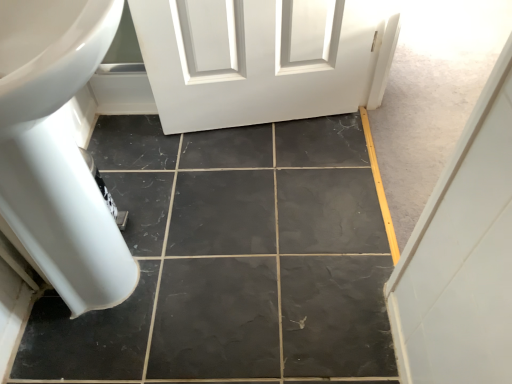
Question: From the image's perspective, does black marble tile at center appear higher than white glossy bath at left?

Choices:
 (A) no
 (B) yes

Answer: (A)

Question: Is black marble tile at center to the left of white glossy bath at left from the viewer's perspective?

Choices:
 (A) yes
 (B) no

Answer: (B)

Question: Is black marble tile at center facing towards white glossy bath at left?

Choices:
 (A) no
 (B) yes

Answer: (A)

Question: Does black marble tile at center lie behind white glossy bath at left?

Choices:
 (A) no
 (B) yes

Answer: (B)

Question: Would you say black marble tile at center is a long distance from white glossy bath at left?

Choices:
 (A) yes
 (B) no

Answer: (B)

Question: From the image's perspective, is black marble tile at center beneath white glossy bath at left?

Choices:
 (A) no
 (B) yes

Answer: (B)

Question: From a real-world perspective, is white glossy bath at left under black marble tile at center?

Choices:
 (A) yes
 (B) no

Answer: (B)

Question: Is white glossy bath at left taller than black marble tile at center?

Choices:
 (A) yes
 (B) no

Answer: (A)

Question: Can you confirm if white glossy bath at left is smaller than black marble tile at center?

Choices:
 (A) yes
 (B) no

Answer: (B)

Question: Is white glossy bath at left aimed at black marble tile at center?

Choices:
 (A) no
 (B) yes

Answer: (B)

Question: Is white glossy bath at left not close to black marble tile at center?

Choices:
 (A) yes
 (B) no

Answer: (B)

Question: From the image's perspective, would you say white glossy bath at left is positioned over black marble tile at center?

Choices:
 (A) no
 (B) yes

Answer: (B)

Question: From a real-world perspective, relative to white glossy bath at left, is black marble tile at center vertically above or below?

Choices:
 (A) below
 (B) above

Answer: (A)